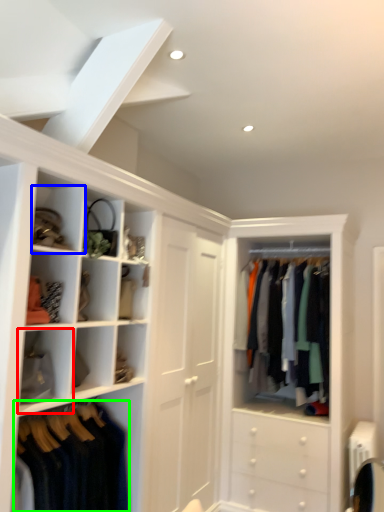
Question: Based on their relative distances, which object is farther from cabinet (highlighted by a red box)? Choose from cabinet (highlighted by a blue box) and clothing (highlighted by a green box).

Choices:
 (A) cabinet
 (B) clothing

Answer: (A)